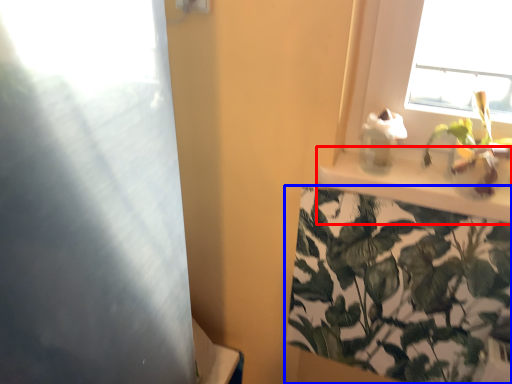
Question: Which point is closer to the camera, window sill (highlighted by a red box) or houseplant (highlighted by a blue box)?

Choices:
 (A) window sill
 (B) houseplant

Answer: (A)